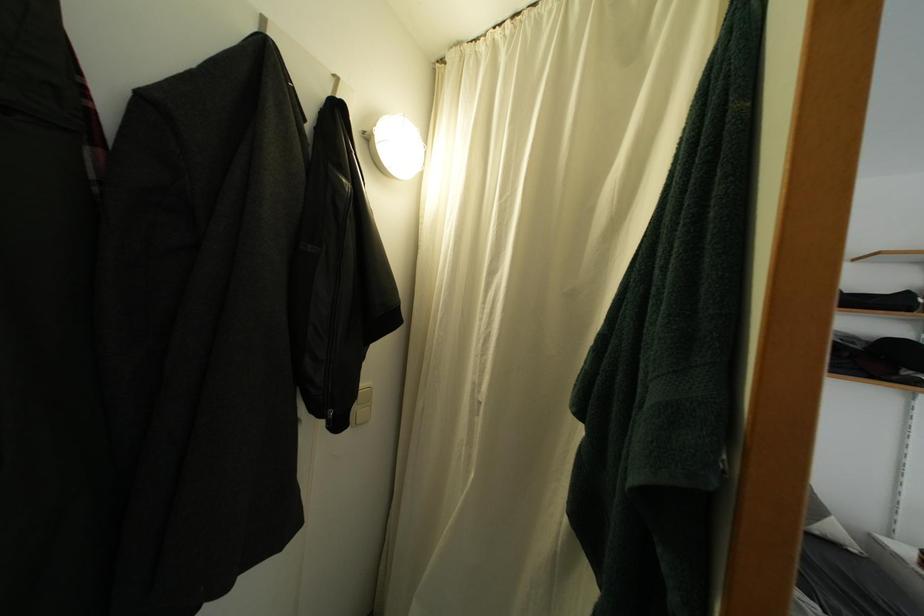
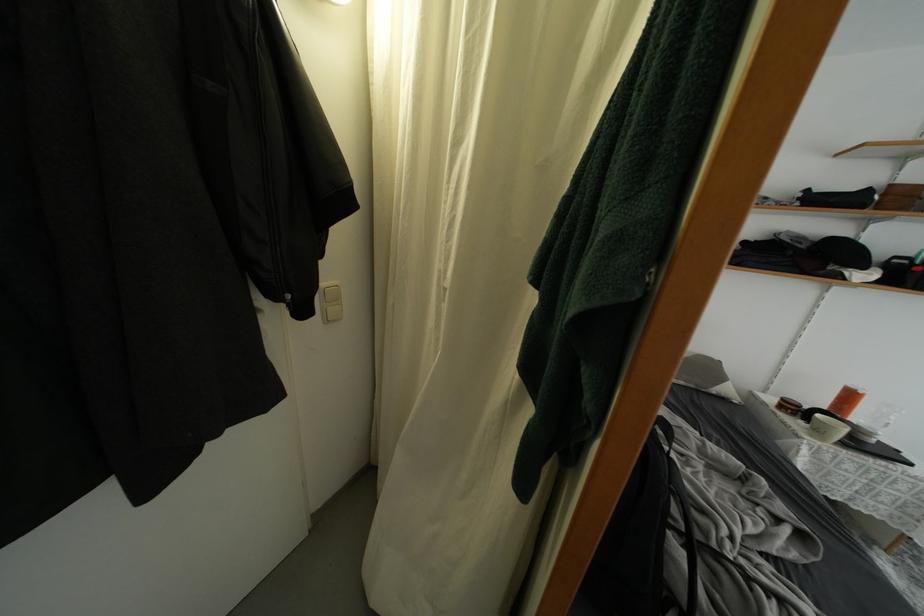
Find the pixel in the second image that matches (864,351) in the first image.

(808, 251)